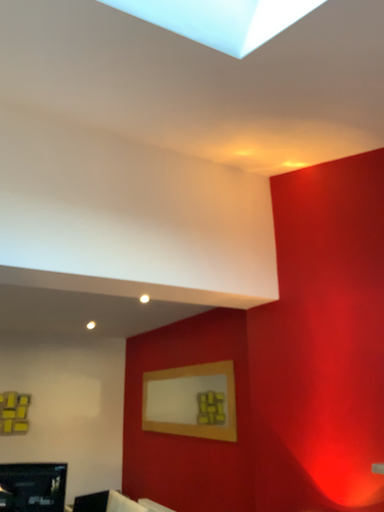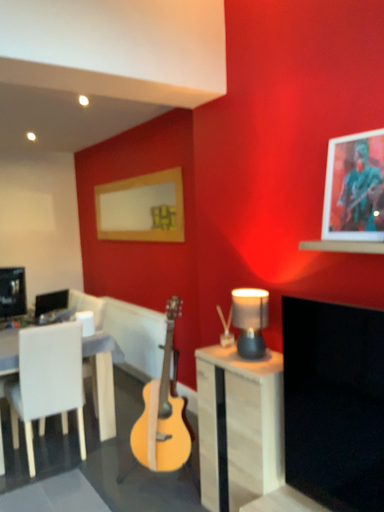
Question: Which way did the camera rotate in the video?

Choices:
 (A) rotated downward
 (B) rotated upward

Answer: (A)